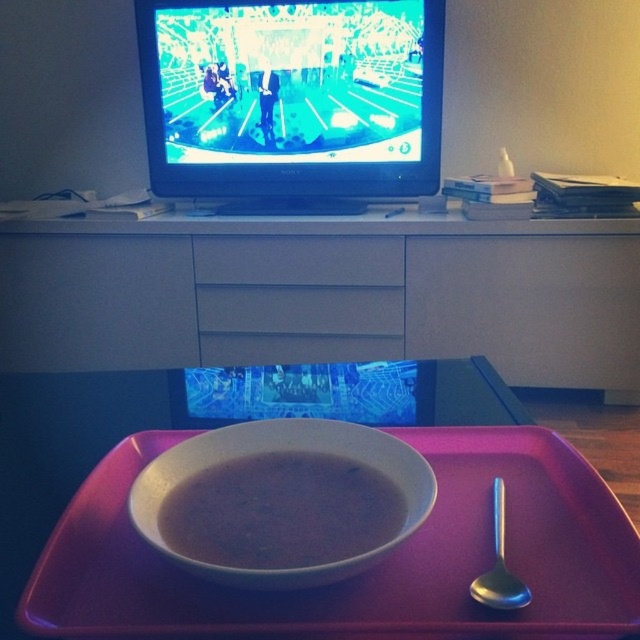
Question: Which object is farther from the camera taking this photo?

Choices:
 (A) white speckled bowl at center
 (B) matte white drawer at center
 (C) pink plastic tray at center

Answer: (B)

Question: Which object appears closest to the camera in this image?

Choices:
 (A) white speckled bowl at center
 (B) pink plastic tray at center
 (C) matte white drawer at center
 (D) matte white cabinet at upper center

Answer: (A)

Question: Which of these objects is positioned farthest from the matte white drawer at center?

Choices:
 (A) matte white cabinet at upper center
 (B) white speckled bowl at center
 (C) pink plastic tray at center

Answer: (B)

Question: Does matte white cabinet at upper center appear under white speckled bowl at center?

Choices:
 (A) no
 (B) yes

Answer: (A)

Question: Is pink plastic tray at center to the left of white speckled bowl at center from the viewer's perspective?

Choices:
 (A) no
 (B) yes

Answer: (A)

Question: Observing the image, what is the correct spatial positioning of pink plastic tray at center in reference to matte white drawer at center?

Choices:
 (A) left
 (B) right

Answer: (B)